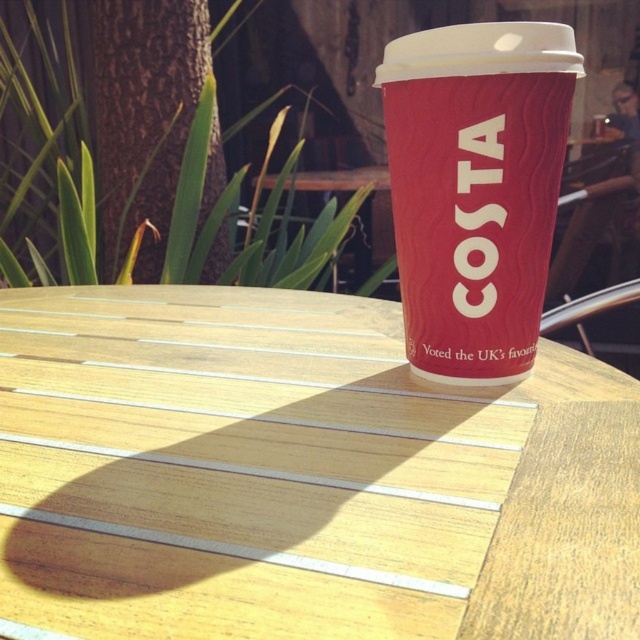
Question: Does wooden table at center appear over matte red cup at center?

Choices:
 (A) yes
 (B) no

Answer: (B)

Question: Can you confirm if wooden table at center is positioned to the right of matte red cup at center?

Choices:
 (A) yes
 (B) no

Answer: (B)

Question: Which object is closer to the camera taking this photo?

Choices:
 (A) wooden table at center
 (B) matte red cup at center

Answer: (A)

Question: Which point is closer to the camera?

Choices:
 (A) (515, 320)
 (B) (77, 566)

Answer: (B)

Question: Considering the relative positions of wooden table at center and matte red cup at center in the image provided, where is wooden table at center located with respect to matte red cup at center?

Choices:
 (A) left
 (B) right

Answer: (A)

Question: Which point appears closest to the camera in this image?

Choices:
 (A) (518, 612)
 (B) (502, 189)

Answer: (A)